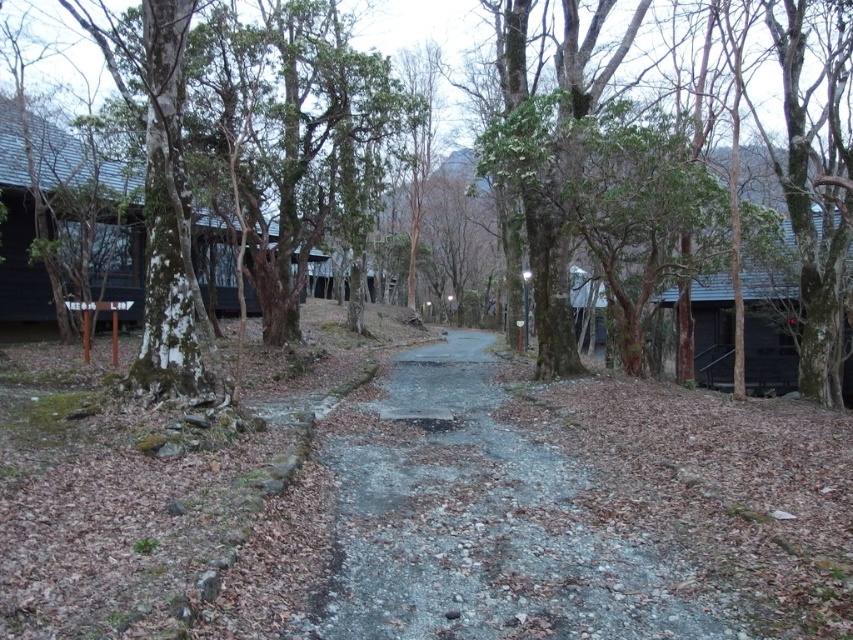
You are standing at the center of the gravel path in the forest scene. You want to reach the matte black cabin at left. In which direction should you walk to get there?

The matte black cabin at left is located at coordinates point (94, 211), so you should walk to the left direction to reach it.

Consider the image. You are standing at the starting point of the gravel path in the forest scene. You want to walk to the point marked at coordinates (x=479, y=522). Is this point located on the gray gravel path at center?

Yes, the point at coordinates (x=479, y=522) is located on the gray gravel path at center as stated in the description.

You are standing on the gravel path in the center of the forest scene. You see the matte black cabin at left and the green rough bark tree at center. Which object is positioned lower in the image?

The matte black cabin at left is below the green rough bark tree at center, so it is positioned lower in the image.